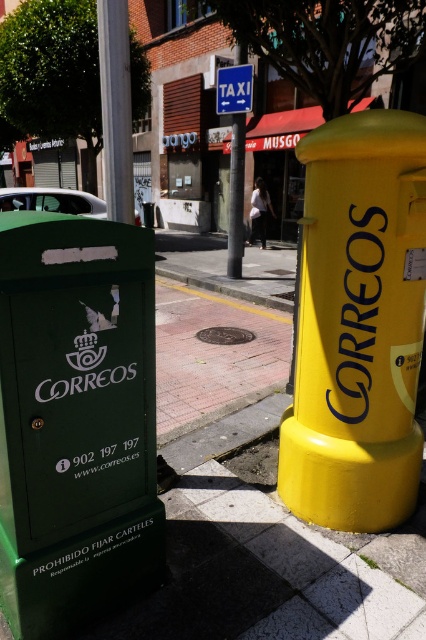
What is the location of the point with coordinates (115,108) in the image?

The point with coordinates (115,108) is located on the smooth white post at center.

You are a delivery person trying to attach a notice to either the matte white car at upper left or the blue plastic taxi sign at upper center. The notice requires a surface that is at least 30 cm in height. Which object would be suitable for attaching the notice?

The matte white car at upper left is much taller than the blue plastic taxi sign at upper center, so the matte white car at upper left would be suitable for attaching the notice since it meets the height requirement.